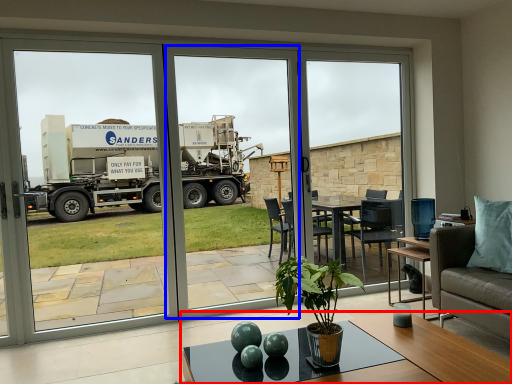
Question: Which object appears closest to the camera in this image, coffee table (highlighted by a red box) or screen door (highlighted by a blue box)?

Choices:
 (A) coffee table
 (B) screen door

Answer: (A)